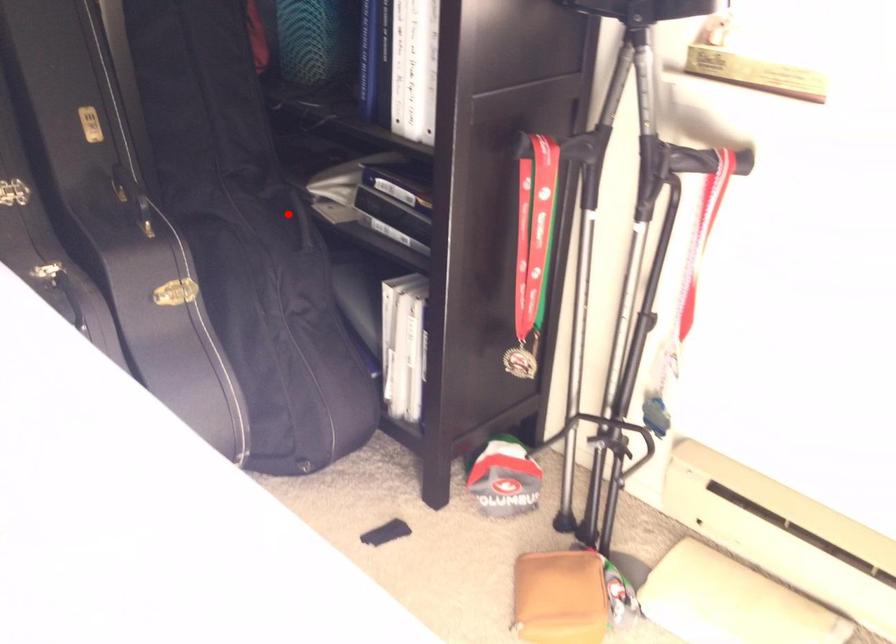
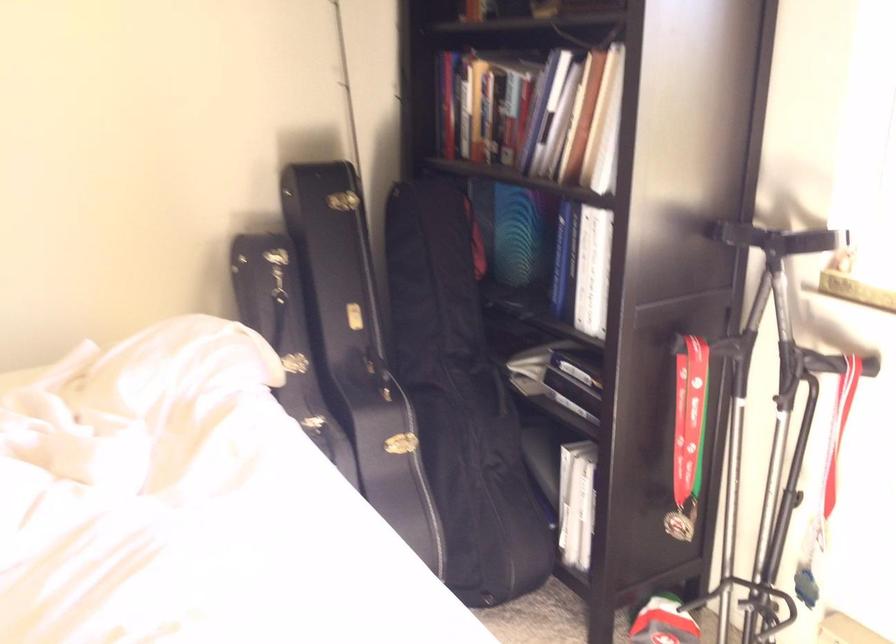
The point at the highlighted location is marked in the first image. Where is the corresponding point in the second image?

(489, 386)